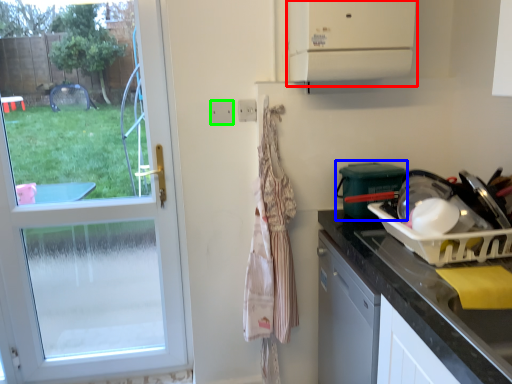
Question: Estimate the real-world distances between objects in this image. Which object is farther from vent (highlighted by a red box), appliance (highlighted by a blue box) or electric outlet (highlighted by a green box)?

Choices:
 (A) appliance
 (B) electric outlet

Answer: (B)